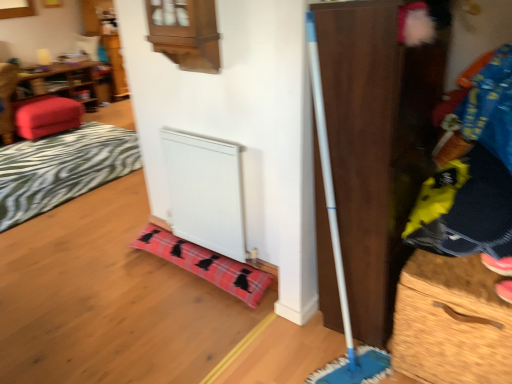
Question: Visually, is white matte radiator at lower center positioned to the left or to the right of matte red ottoman at left?

Choices:
 (A) right
 (B) left

Answer: (A)

Question: From the image's perspective, relative to matte red ottoman at left, is white matte radiator at lower center above or below?

Choices:
 (A) above
 (B) below

Answer: (B)

Question: Estimate the real-world distances between objects in this image. Which object is farther from the matte red ottoman at left?

Choices:
 (A) plaid fabric blanket at lower center, which ranks as the 1th blanket in bottom-to-top order
 (B) wooden drawer at right
 (C) white matte radiator at lower center
 (D) velvet red ottoman at left
 (E) plaid fabric blanket at lower left, which is the 2th blanket in right-to-left order

Answer: (B)

Question: Considering the real-world distances, which object is farthest from the white matte radiator at lower center?

Choices:
 (A) blue denim jeans at right
 (B) plaid fabric blanket at lower center, placed as the second blanket when sorted from top to bottom
 (C) wooden dresser at right
 (D) plaid fabric blanket at lower left, positioned as the first blanket in top-to-bottom order
 (E) matte red ottoman at left

Answer: (E)